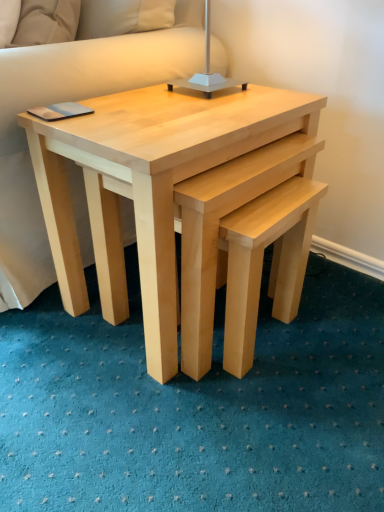
In order to click on vacant space in front of natural wood nesting tables at center in this screenshot , I will do `click(187, 426)`.